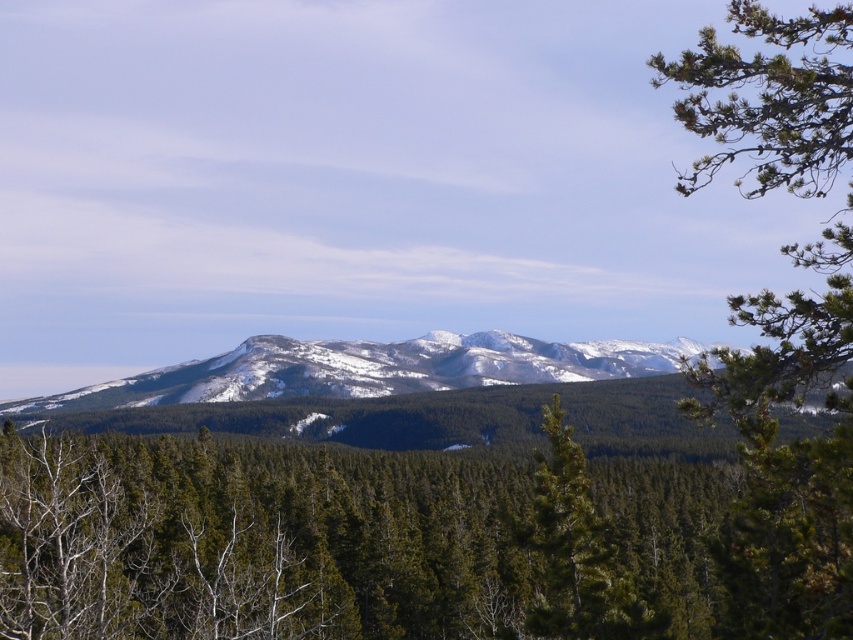
How distant is snowy rocky mountain range at center from green matte tree at center?

A distance of 189.31 meters exists between snowy rocky mountain range at center and green matte tree at center.

Measure the distance between point (442, 380) and camera.

Point (442, 380) and camera are 763.63 feet apart from each other.

Is point (184, 387) positioned after point (628, 620)?

Yes.

Identify the location of snowy rocky mountain range at center. The height and width of the screenshot is (640, 853). (368, 369).

Can you confirm if green needle-like branches at upper right is thinner than snowy rocky mountain range at center?

Yes.

Can you confirm if green needle-like branches at upper right is positioned above snowy rocky mountain range at center?

Yes.

Between point (827, 627) and point (584, 372), which one is positioned behind?

The point (584, 372) is more distant.

Identify the location of green needle-like branches at upper right. (788, 456).

Between green needle-like branches at upper right and green matte tree at center, which one appears on the left side from the viewer's perspective?

green matte tree at center is more to the left.

Which is above, green needle-like branches at upper right or green matte tree at center?

green needle-like branches at upper right

Image resolution: width=853 pixels, height=640 pixels. Describe the element at coordinates (788, 456) in the screenshot. I see `green needle-like branches at upper right` at that location.

Image resolution: width=853 pixels, height=640 pixels. Find the location of `green needle-like branches at upper right`. green needle-like branches at upper right is located at coordinates (788, 456).